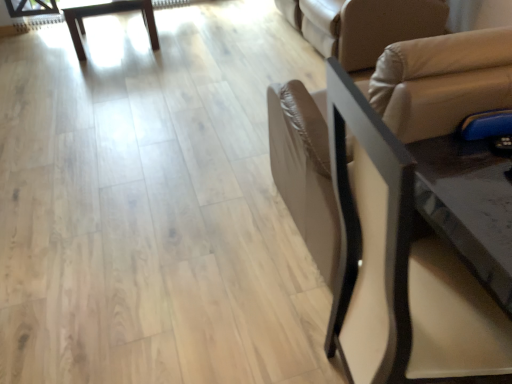
Question: Considering the relative sizes of black leather chair at right and wooden table at upper left in the image provided, is black leather chair at right taller than wooden table at upper left?

Choices:
 (A) no
 (B) yes

Answer: (B)

Question: Is black leather chair at right to the left of wooden table at upper left from the viewer's perspective?

Choices:
 (A) yes
 (B) no

Answer: (B)

Question: Does black leather chair at right appear on the right side of wooden table at upper left?

Choices:
 (A) no
 (B) yes

Answer: (B)

Question: Does black leather chair at right turn towards wooden table at upper left?

Choices:
 (A) no
 (B) yes

Answer: (A)

Question: Considering the relative positions of black leather chair at right and wooden table at upper left in the image provided, is black leather chair at right behind wooden table at upper left?

Choices:
 (A) no
 (B) yes

Answer: (A)

Question: Can we say black leather chair at right lies outside wooden table at upper left?

Choices:
 (A) yes
 (B) no

Answer: (A)

Question: Does beige leather futon at upper right appear on the left side of wooden table at upper left?

Choices:
 (A) yes
 (B) no

Answer: (B)

Question: From the image's perspective, would you say beige leather futon at upper right is shown under wooden table at upper left?

Choices:
 (A) yes
 (B) no

Answer: (A)

Question: Considering the relative sizes of beige leather futon at upper right and wooden table at upper left in the image provided, is beige leather futon at upper right thinner than wooden table at upper left?

Choices:
 (A) yes
 (B) no

Answer: (B)

Question: Is beige leather futon at upper right positioned before wooden table at upper left?

Choices:
 (A) yes
 (B) no

Answer: (A)

Question: Considering the relative sizes of beige leather futon at upper right and wooden table at upper left in the image provided, is beige leather futon at upper right wider than wooden table at upper left?

Choices:
 (A) no
 (B) yes

Answer: (B)

Question: Is wooden table at upper left a part of beige leather futon at upper right?

Choices:
 (A) yes
 (B) no

Answer: (B)

Question: Is wooden table at upper left smaller than beige leather futon at upper right?

Choices:
 (A) no
 (B) yes

Answer: (B)